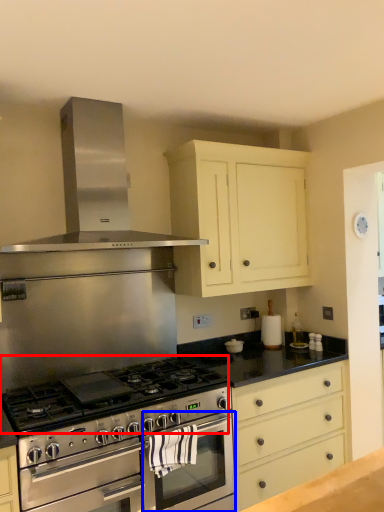
Question: Which of the following is the farthest to the observer, gas stove (highlighted by a red box) or oven (highlighted by a blue box)?

Choices:
 (A) gas stove
 (B) oven

Answer: (B)